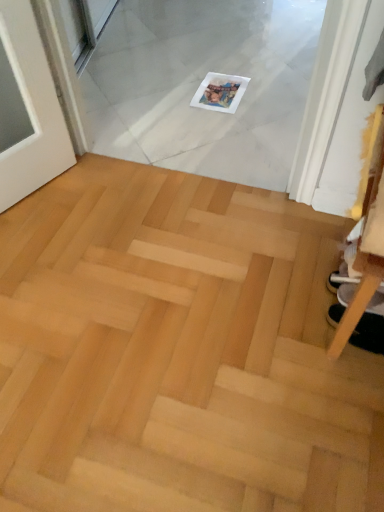
Image resolution: width=384 pixels, height=512 pixels. I want to click on natural wood parquet floor at center, so click(x=178, y=351).

This screenshot has width=384, height=512. Describe the element at coordinates (178, 351) in the screenshot. I see `natural wood parquet floor at center` at that location.

What are the coordinates of `white fabric shoe at lower right` in the screenshot? It's located at (346, 293).

The height and width of the screenshot is (512, 384). What do you see at coordinates (346, 293) in the screenshot?
I see `white fabric shoe at lower right` at bounding box center [346, 293].

This screenshot has width=384, height=512. Find the location of `natural wood parquet floor at center`. natural wood parquet floor at center is located at coordinates (178, 351).

Consider the image. Is natural wood parquet floor at center to the right of white fabric shoe at lower right from the viewer's perspective?

No.

Is the depth of natural wood parquet floor at center greater than that of white fabric shoe at lower right?

No, natural wood parquet floor at center is closer to the camera.

Does point (130, 215) appear closer or farther from the camera than point (343, 297)?

Point (130, 215) is farther from the camera than point (343, 297).

From the image's perspective, is natural wood parquet floor at center over white fabric shoe at lower right?

No, from the image's perspective, natural wood parquet floor at center is not on top of white fabric shoe at lower right.

From a real-world perspective, does natural wood parquet floor at center sit lower than white fabric shoe at lower right?

Yes, from a real-world perspective, natural wood parquet floor at center is under white fabric shoe at lower right.

Does natural wood parquet floor at center have a greater width compared to white fabric shoe at lower right?

Indeed, natural wood parquet floor at center has a greater width compared to white fabric shoe at lower right.

In terms of height, does natural wood parquet floor at center look taller or shorter compared to white fabric shoe at lower right?

natural wood parquet floor at center is shorter than white fabric shoe at lower right.

Who is smaller, natural wood parquet floor at center or white fabric shoe at lower right?

Smaller between the two is white fabric shoe at lower right.

Can white fabric shoe at lower right be found inside natural wood parquet floor at center?

Definitely not — white fabric shoe at lower right is not inside natural wood parquet floor at center.

Is natural wood parquet floor at center positioned far away from white fabric shoe at lower right?

natural wood parquet floor at center is near white fabric shoe at lower right, not far away.

Could you tell me if natural wood parquet floor at center is turned towards white fabric shoe at lower right?

No, natural wood parquet floor at center does not turn towards white fabric shoe at lower right.

How many degrees apart are the facing directions of natural wood parquet floor at center and white fabric shoe at lower right?

89.9 degrees.

Find the location of a particular element. The height and width of the screenshot is (512, 384). stairwell to the left of white fabric shoe at lower right is located at coordinates (178, 351).

Is white fabric shoe at lower right to the left of natural wood parquet floor at center from the viewer's perspective?

In fact, white fabric shoe at lower right is to the right of natural wood parquet floor at center.

Between white fabric shoe at lower right and natural wood parquet floor at center, which one is positioned in front?

natural wood parquet floor at center is in front.

Is point (382, 311) farther from camera compared to point (172, 461)?

No.

From the image's perspective, is white fabric shoe at lower right on natural wood parquet floor at center?

Correct, white fabric shoe at lower right appears higher than natural wood parquet floor at center in the image.

From a real-world perspective, is white fabric shoe at lower right physically located above or below natural wood parquet floor at center?

Clearly, from a real-world perspective, white fabric shoe at lower right is above natural wood parquet floor at center.

Looking at their sizes, would you say white fabric shoe at lower right is wider or thinner than natural wood parquet floor at center?

In the image, white fabric shoe at lower right appears to be more narrow than natural wood parquet floor at center.

Does white fabric shoe at lower right have a lesser height compared to natural wood parquet floor at center?

No.

Consider the image. Can you confirm if white fabric shoe at lower right is bigger than natural wood parquet floor at center?

Actually, white fabric shoe at lower right might be smaller than natural wood parquet floor at center.

Is white fabric shoe at lower right completely or partially outside of natural wood parquet floor at center?

Yes.

Are white fabric shoe at lower right and natural wood parquet floor at center located far from each other?

white fabric shoe at lower right is actually quite close to natural wood parquet floor at center.

Is white fabric shoe at lower right oriented away from natural wood parquet floor at center?

white fabric shoe at lower right does not have its back to natural wood parquet floor at center.

How many degrees apart are the facing directions of white fabric shoe at lower right and natural wood parquet floor at center?

89.9 degrees.

Identify the location of stairwell that appears below the white fabric shoe at lower right (from a real-world perspective). The image size is (384, 512). (178, 351).

This screenshot has width=384, height=512. I want to click on stairwell below the white fabric shoe at lower right (from the image's perspective), so click(178, 351).

Locate an element on the screen. footwear located behind the natural wood parquet floor at center is located at coordinates [346, 293].